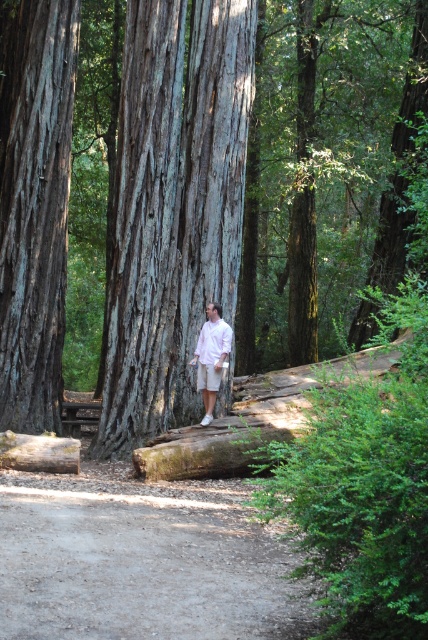
You are a hiker who wants to take a photo of the smooth brown tree trunk at left and the white matte shirt at center together in the same frame. Given that your camera has a maximum focus range of 7 meters, will you be able to capture both objects in focus?

The distance between the smooth brown tree trunk at left and the white matte shirt at center is 7.31 meters. Since your camera can only focus up to 7 meters, you won not be able to capture both objects in focus as the distance exceeds the camera range.

You are standing in the forest looking at the scene. There are two points marked in the image. The first point is at coordinates point (65, 216) and the second is at point (273, 564). Which point is closer to you?

Point (65, 216) is further to the camera than point (273, 564). Therefore, point (273, 564) is closer to you.